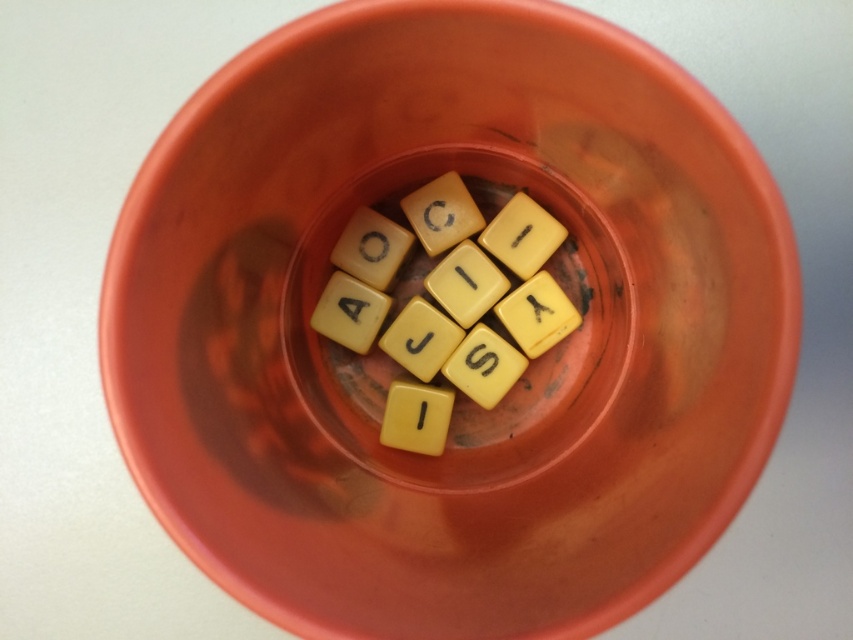
Question: Which object is farther from the camera taking this photo?

Choices:
 (A) yellow matte tile at center
 (B) yellow matte letter tile at center
 (C) yellow matte letter at center
 (D) yellow matte letter tiles at center

Answer: (C)

Question: Is yellow matte letter tiles at center thinner than yellow matte letter tile at center?

Choices:
 (A) no
 (B) yes

Answer: (A)

Question: Among these objects, which one is farthest from the camera?

Choices:
 (A) yellow matte letter tiles at center
 (B) yellow matte letter i at center
 (C) yellow matte letter at center
 (D) yellow matte tile at center

Answer: (C)

Question: Does yellow matte tile at center appear on the right side of yellow matte letter tile at center?

Choices:
 (A) yes
 (B) no

Answer: (A)

Question: Which point appears closest to the camera in this image?

Choices:
 (A) (564, 328)
 (B) (376, 326)
 (C) (485, 268)

Answer: (C)

Question: Is yellow matte letter at center positioned before yellow matte letter i at center?

Choices:
 (A) yes
 (B) no

Answer: (B)